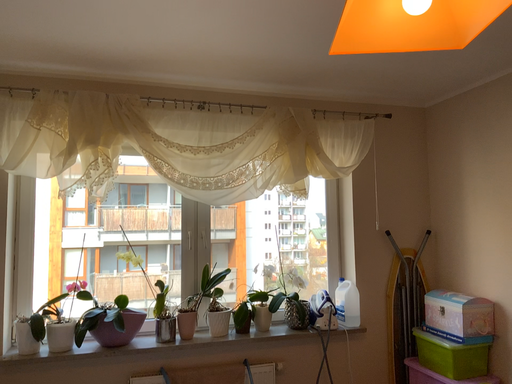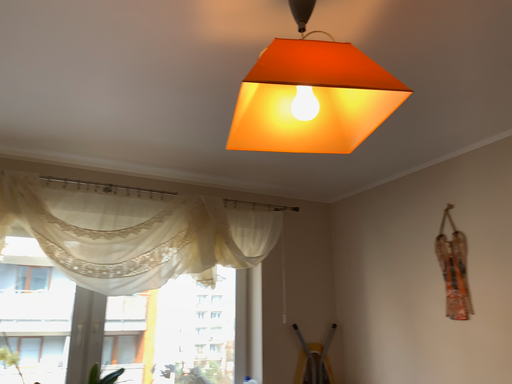
Question: How did the camera likely rotate when shooting the video?

Choices:
 (A) rotated downward
 (B) rotated upward

Answer: (B)